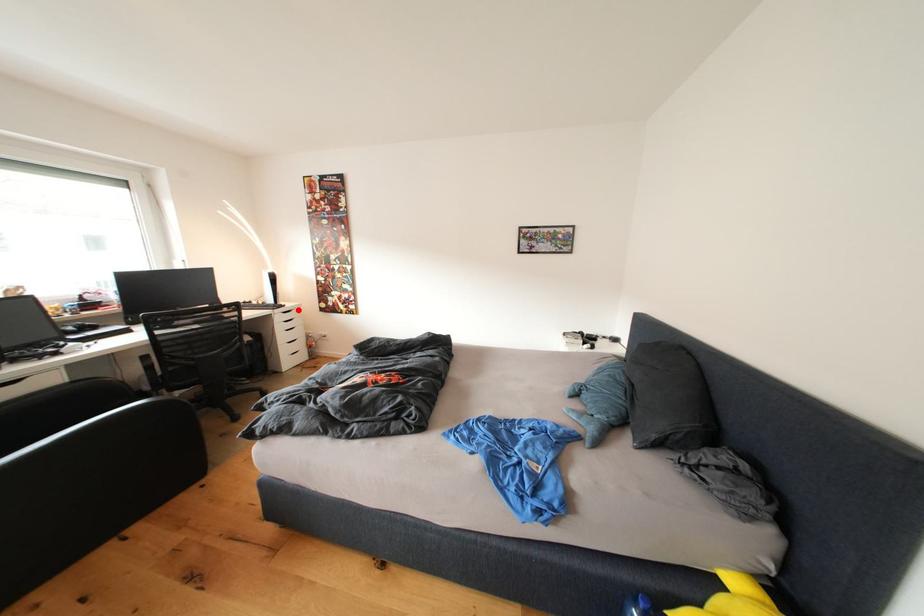
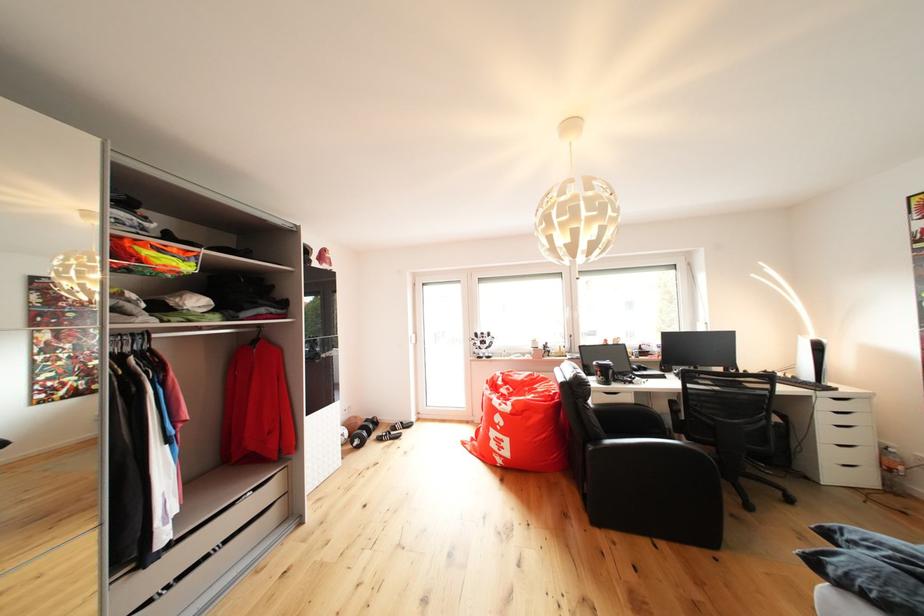
In the second image, find the point that corresponds to the highlighted location in the first image.

(855, 395)